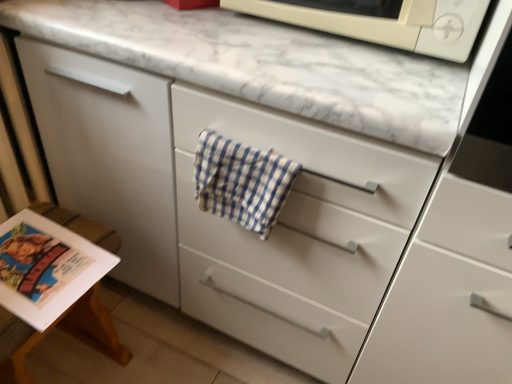
Question: Would you say blue checkered towel at center is to the left or to the right of matte paper magazine at lower left in the picture?

Choices:
 (A) right
 (B) left

Answer: (A)

Question: Is point (225, 216) positioned closer to the camera than point (83, 258)?

Choices:
 (A) farther
 (B) closer

Answer: (B)

Question: Estimate the real-world distances between objects in this image. Which object is closer to the blue checkered towel at center?

Choices:
 (A) white matte microwave at upper center
 (B) matte paper magazine at lower left

Answer: (A)

Question: Estimate the real-world distances between objects in this image. Which object is farther from the white matte microwave at upper center?

Choices:
 (A) blue checkered towel at center
 (B) matte paper magazine at lower left

Answer: (B)